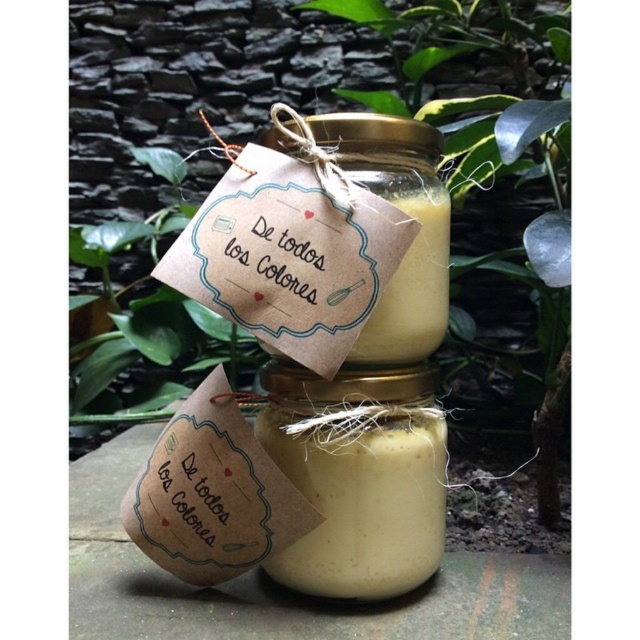
Is point (534, 371) positioned before point (397, 205)?

No, (534, 371) is behind (397, 205).

Is point (77, 387) positioned behind point (420, 314)?

Yes.

Where is `green leafy plant at center`? Image resolution: width=640 pixels, height=640 pixels. green leafy plant at center is located at coordinates (378, 112).

Can you confirm if green leafy plant at center is positioned above translucent glass jar at center?

Indeed, green leafy plant at center is positioned over translucent glass jar at center.

Is point (506, 77) more distant than point (353, 365)?

Yes, point (506, 77) is farther from viewer.

Who is more forward, (332,67) or (291,456)?

Point (291,456) is more forward.

In order to click on green leafy plant at center in this screenshot , I will do (378, 112).

Between point (348, 556) and point (348, 172), which one is positioned in front?

Point (348, 172) is in front.

Which is in front, point (385, 593) or point (413, 284)?

Point (413, 284) is more forward.

In order to click on translucent glass jar at center in this screenshot , I will do `click(358, 476)`.